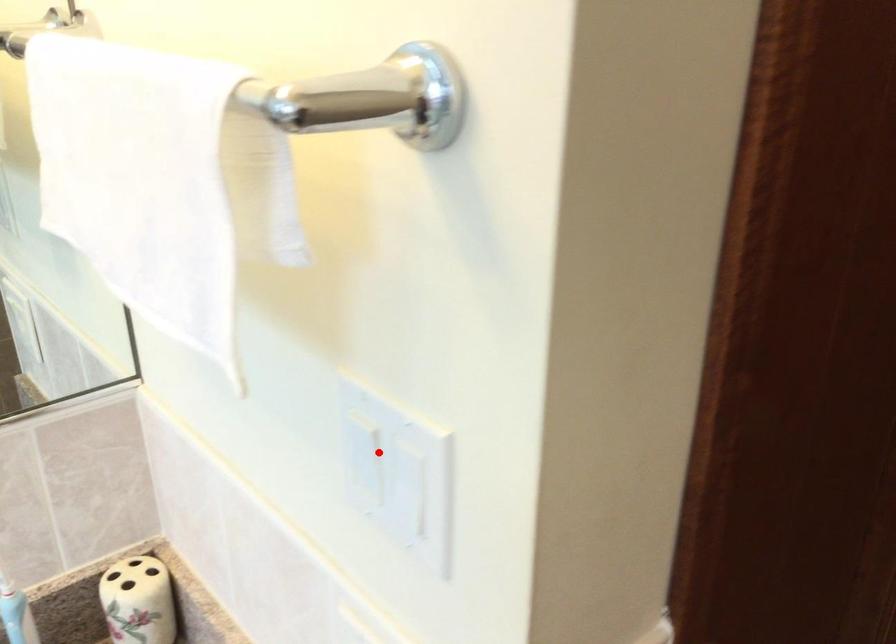
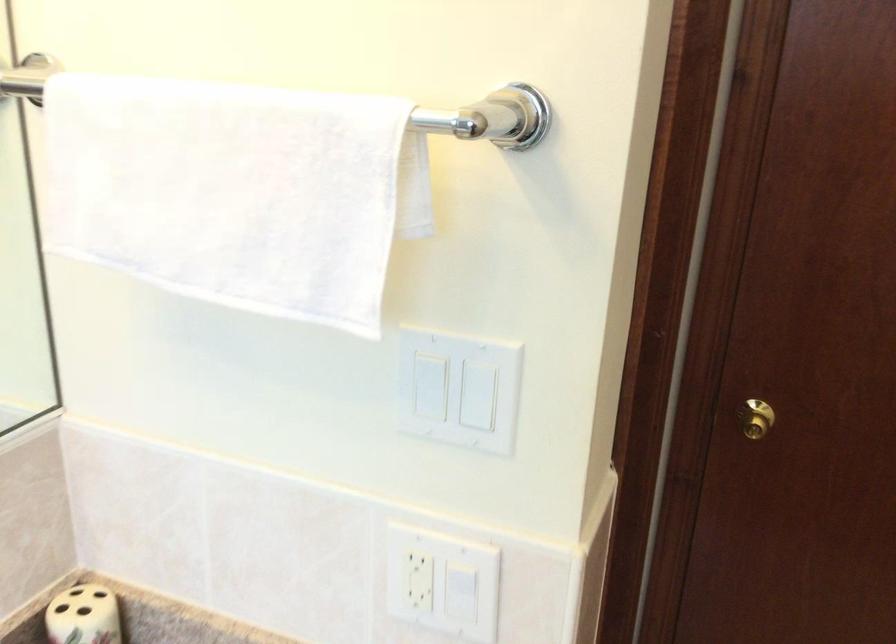
Find the pixel in the second image that matches the highlighted location in the first image.

(429, 386)